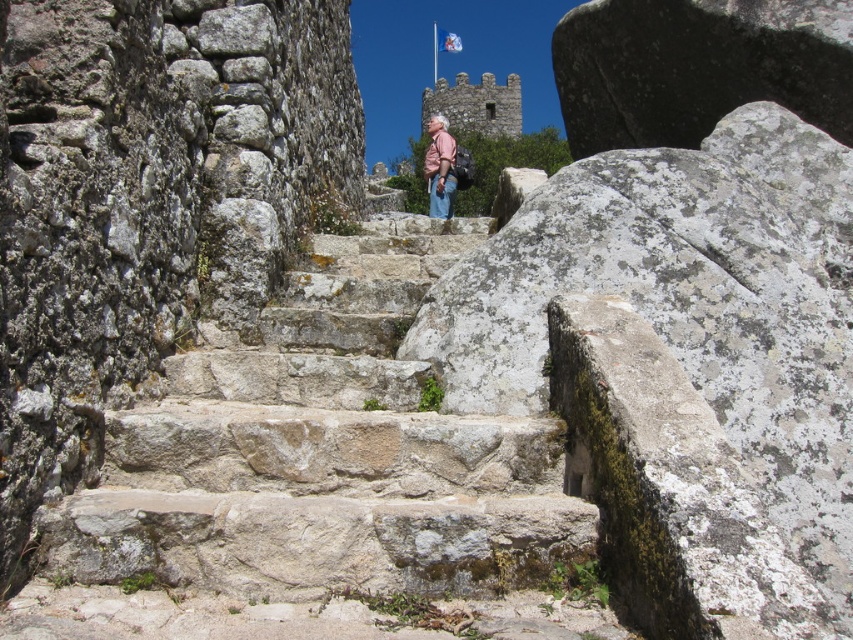
You are standing at the bottom of the rugged stone staircase looking up. There are two points marked on the staircase, point (494,113) and point (433,186). Which point is closer to you?

Point (494,113) is closer to you because it is further to the viewer than point (433,186).

You are planning to climb the natural stone stairs at center while wearing the pink fabric shirt at center. Based on the scene description, which item is located lower in the image?

The natural stone stairs at center is positioned under the pink fabric shirt at center, so the natural stone stairs at center is lower in the image.